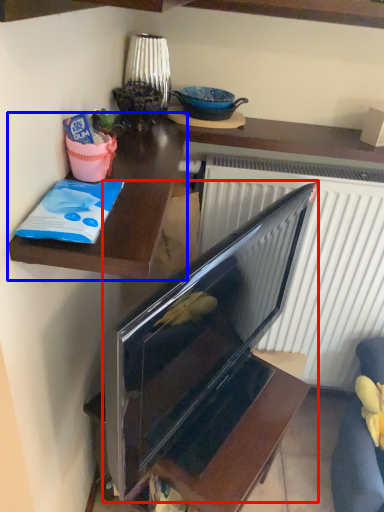
Question: Which object appears closest to the camera in this image, television (highlighted by a red box) or desk (highlighted by a blue box)?

Choices:
 (A) television
 (B) desk

Answer: (A)